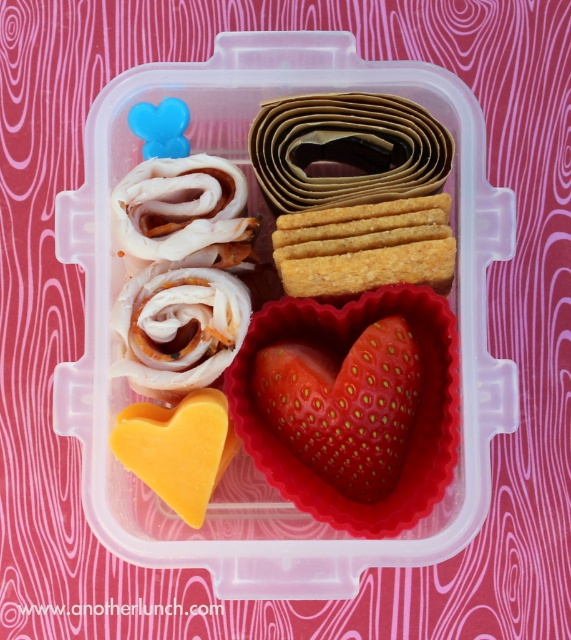
Question: Which point is farther to the camera?

Choices:
 (A) (333, 243)
 (B) (299, 388)

Answer: (A)

Question: Is red matte strawberry at center wider than golden crisp crackers at center?

Choices:
 (A) no
 (B) yes

Answer: (A)

Question: Does red matte strawberry at center have a smaller size compared to golden crisp crackers at center?

Choices:
 (A) no
 (B) yes

Answer: (A)

Question: Does red matte strawberry at center appear under golden crisp crackers at center?

Choices:
 (A) no
 (B) yes

Answer: (B)

Question: Which point is closer to the camera?

Choices:
 (A) (303, 212)
 (B) (388, 364)

Answer: (B)

Question: Which of the following is the closest to the observer?

Choices:
 (A) red matte strawberry at center
 (B) golden crisp crackers at center

Answer: (B)